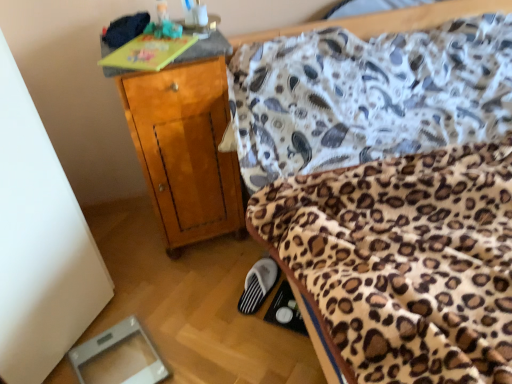
Identify the location of vacant area that is in front of black suede slipper at lower center. Image resolution: width=512 pixels, height=384 pixels. (258, 328).